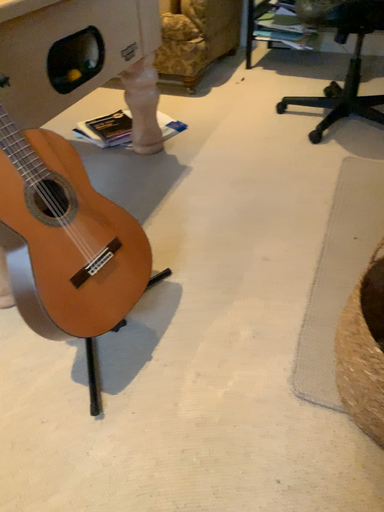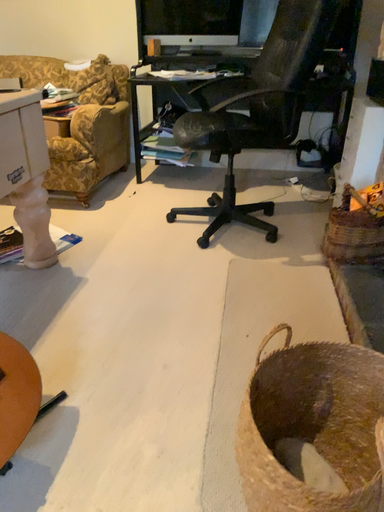
Question: Which way did the camera rotate in the video?

Choices:
 (A) rotated upward
 (B) rotated downward

Answer: (A)